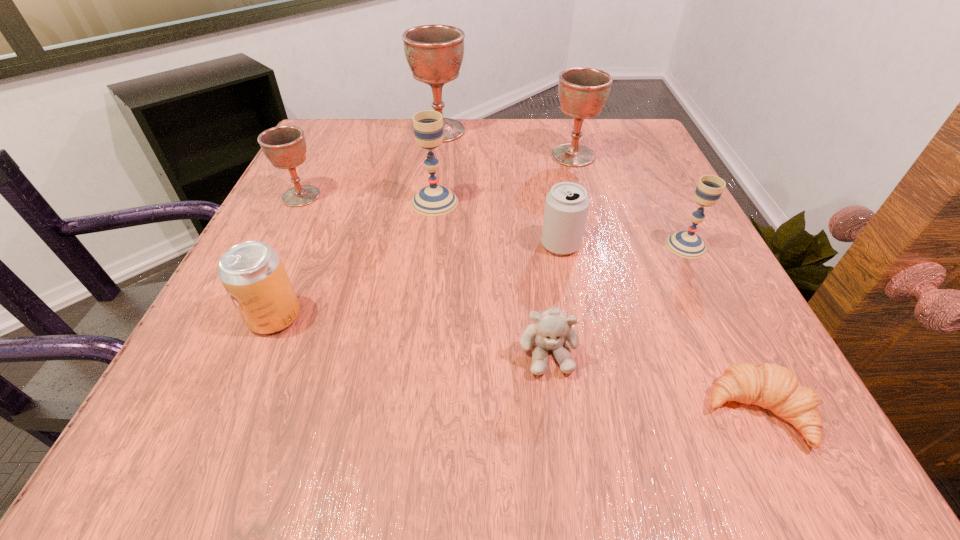
At what (x,y) coordinates should I click in order to perform the action: click on vacant space located on the back of the pop (soda). Please return your answer as a coordinate pair (x, y). Looking at the image, I should click on click(330, 186).

Image resolution: width=960 pixels, height=540 pixels. Find the location of `vacant space located 0.080m on the back of the can`. vacant space located 0.080m on the back of the can is located at coordinates (553, 206).

Find the location of a particular element. This screenshot has height=540, width=960. vacant region located on the face of the gray teddy bear is located at coordinates (561, 446).

Find the location of a particular element. blank space located on the left of the crescent roll is located at coordinates (434, 411).

At what (x,y) coordinates should I click in order to perform the action: click on object located at the near edge. Please return your answer as a coordinate pair (x, y). The height and width of the screenshot is (540, 960). Looking at the image, I should click on (768, 385).

This screenshot has height=540, width=960. I want to click on chalice that is at the left edge, so (284, 146).

Locate an element on the screen. pop (soda) located at the left edge is located at coordinates (252, 272).

This screenshot has height=540, width=960. In order to click on crescent roll that is at the right edge in this screenshot , I will do `click(768, 385)`.

Locate an element on the screen. Image resolution: width=960 pixels, height=540 pixels. object that is at the far right corner is located at coordinates (583, 91).

In order to click on object present at the near right corner in this screenshot , I will do `click(768, 385)`.